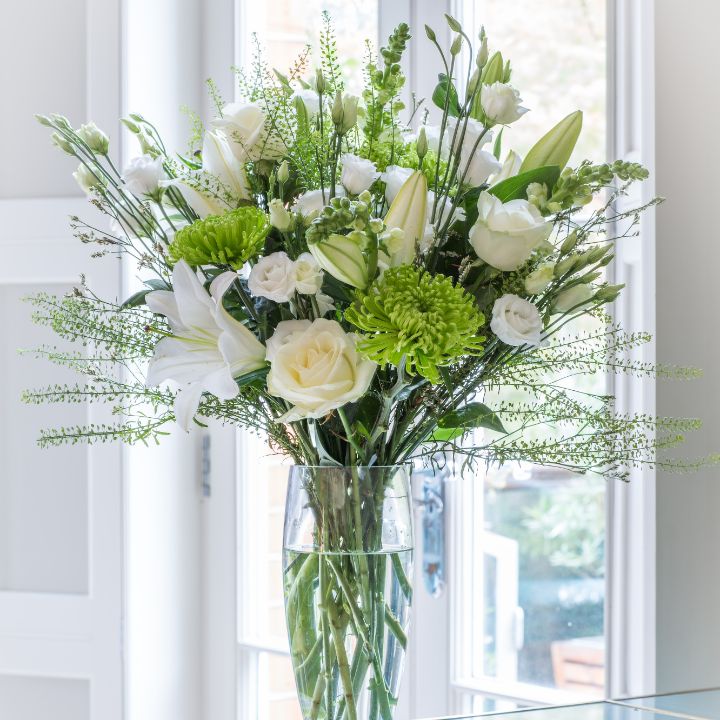
At what (x,y) coordinates should I click in order to perform the action: click on walls. Please return your answer as a coordinate pair (x, y). Looking at the image, I should click on (26, 505), (680, 255).